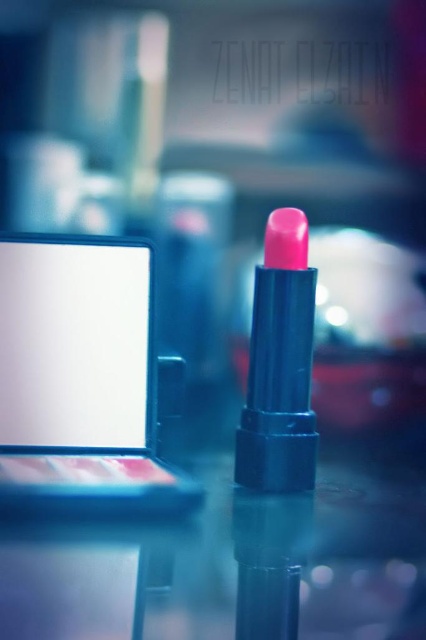
Question: From the image, what is the correct spatial relationship of white matte screen at center in relation to matte pink lipstick at center?

Choices:
 (A) below
 (B) above

Answer: (B)

Question: Is white matte screen at center below matte pink lipstick at center?

Choices:
 (A) yes
 (B) no

Answer: (B)

Question: Which of the following is the farthest from the observer?

Choices:
 (A) (126, 298)
 (B) (267, 240)

Answer: (B)

Question: Can you confirm if white matte screen at center is positioned to the right of matte pink lipstick at center?

Choices:
 (A) yes
 (B) no

Answer: (B)

Question: Which point is closer to the camera?

Choices:
 (A) matte pink lipstick at center
 (B) white matte screen at center

Answer: (B)

Question: Which point is farther to the camera?

Choices:
 (A) matte pink lipstick at center
 (B) white matte screen at center

Answer: (A)